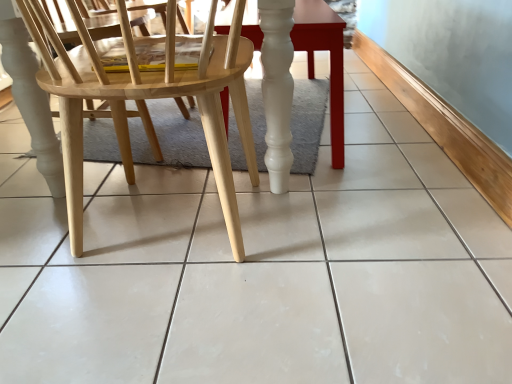
The image size is (512, 384). I want to click on free region under natural wood chair at left (from a real-world perspective), so click(x=170, y=235).